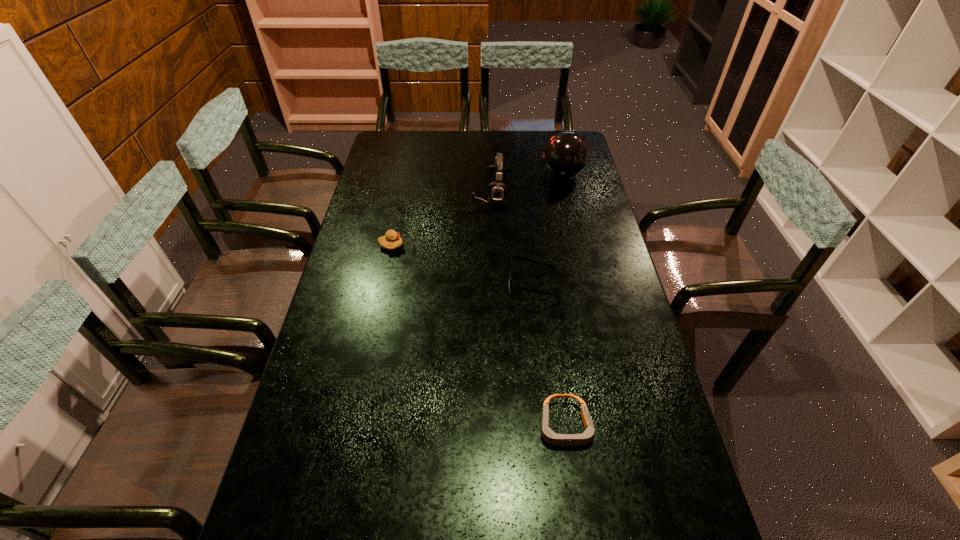
Where is `vacant space located on the surface of the bowling ball near the finger holes`? The image size is (960, 540). vacant space located on the surface of the bowling ball near the finger holes is located at coordinates (520, 174).

Find the location of a particular element. vacant space located with the microphone on the side of the headset is located at coordinates (453, 194).

Find the location of a particular element. The image size is (960, 540). free location located 0.160m with the microphone on the side of the headset is located at coordinates (430, 194).

This screenshot has width=960, height=540. I want to click on vacant region located with the microphone on the side of the headset, so (433, 194).

This screenshot has height=540, width=960. Identify the location of vacant space located at the beak of the duckling. pyautogui.click(x=507, y=246).

This screenshot has width=960, height=540. Find the location of `blank area located 0.390m on the front-facing side of the sunglasses`. blank area located 0.390m on the front-facing side of the sunglasses is located at coordinates (385, 283).

Locate an element on the screen. free region located 0.140m on the front-facing side of the sunglasses is located at coordinates click(x=464, y=283).

At what (x,y) coordinates should I click in order to perform the action: click on free space located 0.180m on the front-facing side of the sunglasses. Please return your answer as a coordinate pair (x, y). Looking at the image, I should click on (451, 283).

Find the location of a particular element. blank area located 0.120m on the front and back of the goggles is located at coordinates (577, 511).

At what (x,y) coordinates should I click in order to perform the action: click on object that is at the left edge. Please return your answer as a coordinate pair (x, y). This screenshot has height=540, width=960. Looking at the image, I should click on (391, 241).